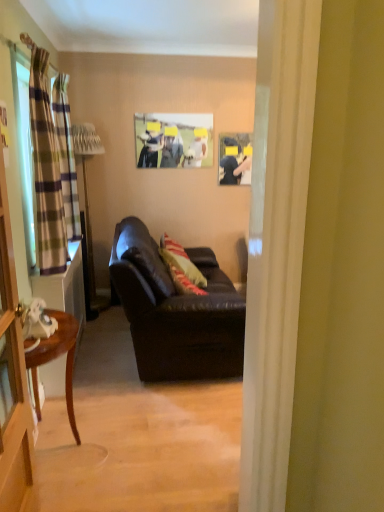
Question: Is plaid fabric curtain at left, the 1th curtain viewed from the back, facing away from matte plastic picture frame at upper center?

Choices:
 (A) no
 (B) yes

Answer: (A)

Question: From the image's perspective, is plaid fabric curtain at left, the 1th curtain viewed from the back, above matte plastic picture frame at upper center?

Choices:
 (A) no
 (B) yes

Answer: (A)

Question: From a real-world perspective, does plaid fabric curtain at left, the 1th curtain viewed from the back, stand above matte plastic picture frame at upper center?

Choices:
 (A) yes
 (B) no

Answer: (B)

Question: Can you confirm if plaid fabric curtain at left, the 1th curtain viewed from the back, is smaller than matte plastic picture frame at upper center?

Choices:
 (A) no
 (B) yes

Answer: (A)

Question: Is plaid fabric curtain at left, the second curtain in the front-to-back sequence, further to camera compared to matte plastic picture frame at upper center?

Choices:
 (A) yes
 (B) no

Answer: (B)

Question: Is plaid fabric curtain at left, the second curtain in the front-to-back sequence, far from matte plastic picture frame at upper center?

Choices:
 (A) no
 (B) yes

Answer: (B)

Question: Does leather couch at center appear on the right side of plaid fabric curtain at left, the 1th curtain viewed from the back?

Choices:
 (A) no
 (B) yes

Answer: (B)

Question: Does leather couch at center have a smaller size compared to plaid fabric curtain at left, the second curtain in the front-to-back sequence?

Choices:
 (A) yes
 (B) no

Answer: (B)

Question: Is leather couch at center next to plaid fabric curtain at left, the 1th curtain viewed from the back, and touching it?

Choices:
 (A) yes
 (B) no

Answer: (B)

Question: From the image's perspective, is leather couch at center beneath plaid fabric curtain at left, the second curtain in the front-to-back sequence?

Choices:
 (A) no
 (B) yes

Answer: (B)

Question: Are leather couch at center and plaid fabric curtain at left, the 1th curtain viewed from the back, located far from each other?

Choices:
 (A) no
 (B) yes

Answer: (A)

Question: Is leather couch at center surrounding plaid fabric curtain at left, the second curtain in the front-to-back sequence?

Choices:
 (A) yes
 (B) no

Answer: (B)

Question: Is green plaid curtain at left, positioned as the 2th curtain in back-to-front order, aimed at striped fabric pillow at center?

Choices:
 (A) yes
 (B) no

Answer: (B)